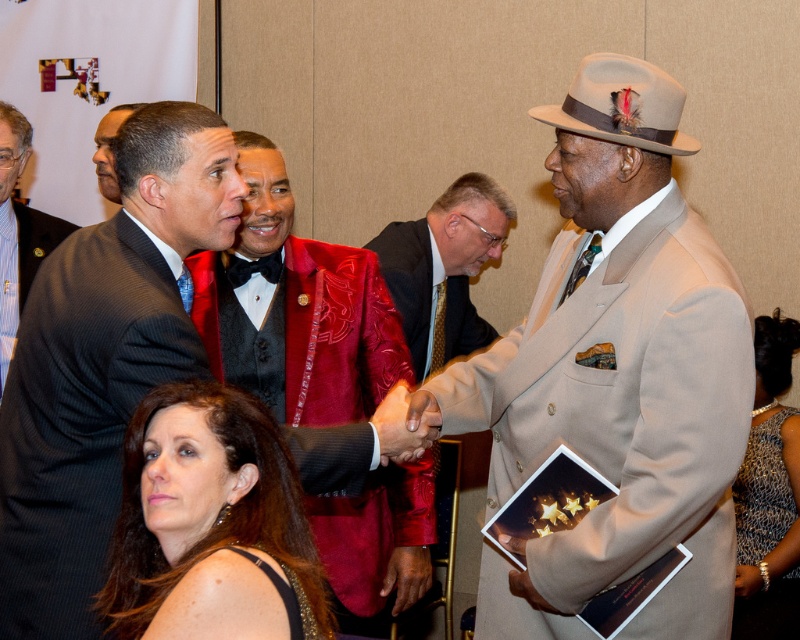
Question: Is dark gray pinstripe suit at left thinner than light blue striped shirt at left?

Choices:
 (A) yes
 (B) no

Answer: (B)

Question: Can you confirm if beige wool suit at center is positioned to the left of black satin bow tie at center?

Choices:
 (A) yes
 (B) no

Answer: (B)

Question: Can you confirm if velvet red jacket at center is bigger than brown hair at lower left?

Choices:
 (A) yes
 (B) no

Answer: (A)

Question: Which object appears closest to the camera in this image?

Choices:
 (A) sparkly silver dress at lower right
 (B) shiny red velvet jacket at center
 (C) beige wool suit at center
 (D) smooth black suit at center

Answer: (C)

Question: Which point is farther to the camera?

Choices:
 (A) shiny red velvet jacket at center
 (B) shiny red jacket at center
 (C) sparkly silver dress at lower right
 (D) brown hair at lower left

Answer: (B)

Question: Which object is closer to the camera taking this photo?

Choices:
 (A) shiny red velvet jacket at center
 (B) velvet red jacket at center

Answer: (B)